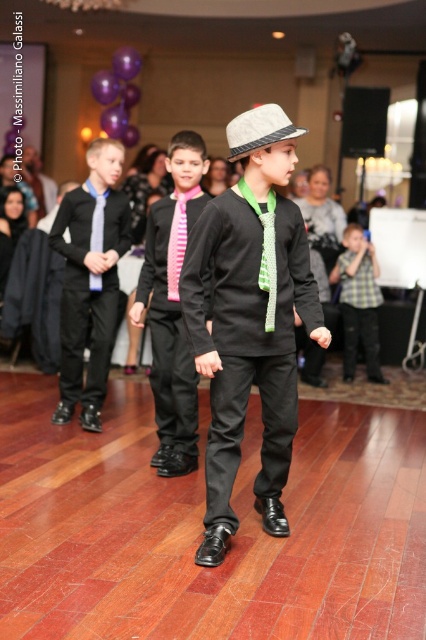
You are a photographer at the event and want to capture a clear shot of both the matte black shirt at center and the felt fedora at center. Since you have a limited zoom range, which object should you focus on first to ensure it appears larger in the photo?

The matte black shirt at center is larger in size than the felt fedora at center, so you should focus on the matte black shirt at center first to ensure it appears larger in the photo.

You are a photographer at the event and need to capture a photo where both the matte black suit at center and the checkered fabric shirt at right are visible. Given their heights, which object should you position closer to the camera to ensure both are fully visible in the frame?

Since the matte black suit at center is taller than the checkered fabric shirt at right, you should position the checkered fabric shirt at right closer to the camera to ensure both are fully visible in the frame.

You are standing at the entrance of the banquet hall and see two points marked in the image. Which point is closer to you, point (267, 396) or point (345, 273)?

Point (267, 396) is in front of point (345, 273), so it is closer to you.